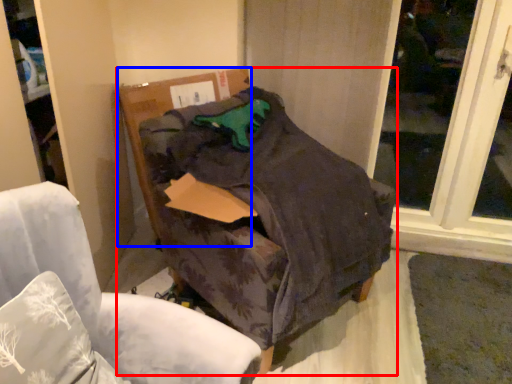
Question: Which of the following is the closest to the observer, furniture (highlighted by a red box) or cardboard box (highlighted by a blue box)?

Choices:
 (A) furniture
 (B) cardboard box

Answer: (A)